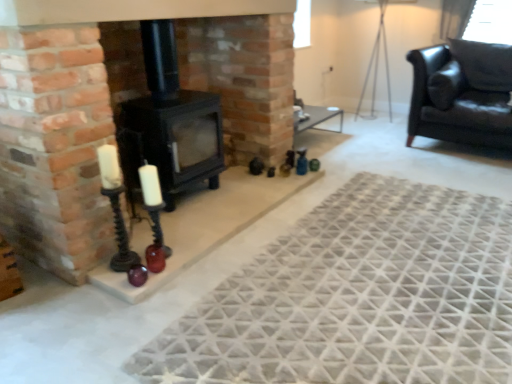
At what (x,y) coordinates should I click in order to perform the action: click on free spot behind black glass candle holder at lower left, placed as the 1th candle holder when sorted from right to left. Please return your answer as a coordinate pair (x, y). The width and height of the screenshot is (512, 384). Looking at the image, I should click on (166, 237).